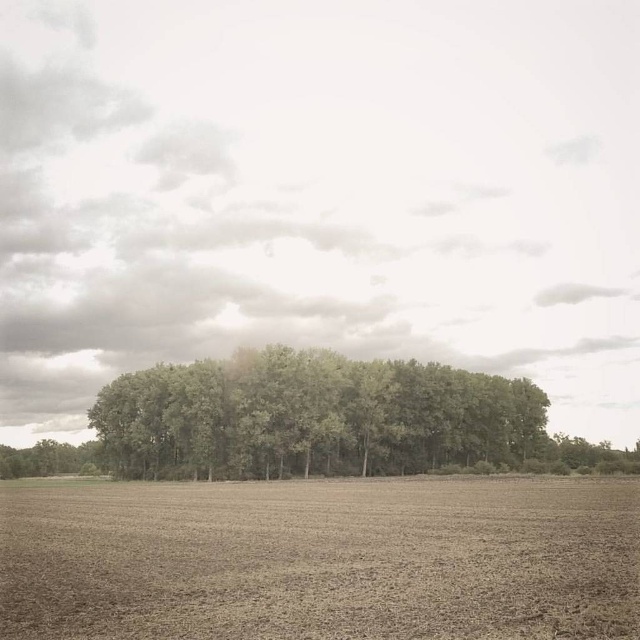
Question: Which object is farther from the camera taking this photo?

Choices:
 (A) green leafy trees at center
 (B) brown soil at center

Answer: (A)

Question: Does brown soil at center come in front of green leafy trees at center?

Choices:
 (A) no
 (B) yes

Answer: (B)

Question: Can you confirm if brown soil at center is smaller than green leafy trees at center?

Choices:
 (A) yes
 (B) no

Answer: (A)

Question: Can you confirm if brown soil at center is wider than green leafy trees at center?

Choices:
 (A) yes
 (B) no

Answer: (B)